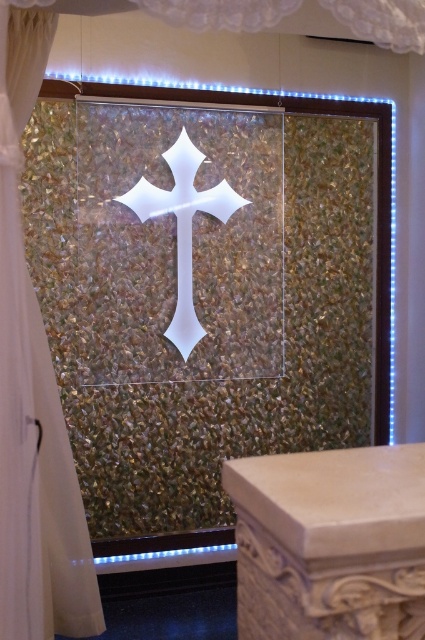
You are standing in the room and notice a point marked at coordinates (33, 397). According to the scene description, what object is located at that point?

The point at coordinates (33, 397) marks the location of the white sheer curtain at center.

You are standing in front of the mosaic window and notice the white sheer curtain at center and the white glossy cross at center. Which object is taller?

The white sheer curtain at center is taller than the white glossy cross at center.